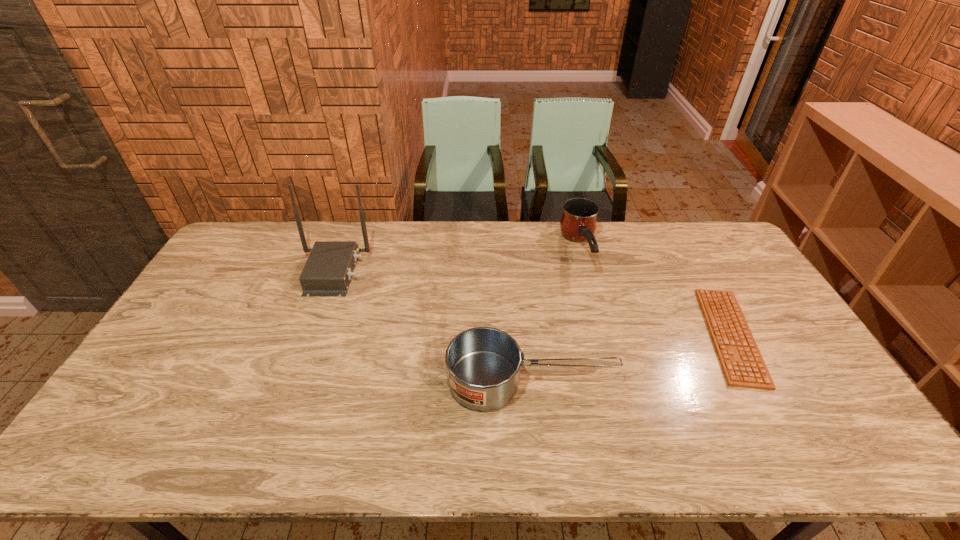
What are the coordinates of `vacant space located 0.220m with the handle extending from one side of the nearer saucepan` in the screenshot? It's located at (697, 381).

The image size is (960, 540). Find the location of `free space located 0.370m on the back of the shortest object`. free space located 0.370m on the back of the shortest object is located at coordinates (670, 225).

Identify the location of router present at the far edge. This screenshot has height=540, width=960. (328, 270).

Where is `saucepan that is at the far edge`? saucepan that is at the far edge is located at coordinates (578, 223).

The width and height of the screenshot is (960, 540). Identify the location of object that is at the right edge. (743, 366).

The height and width of the screenshot is (540, 960). What are the coordinates of `vacant space at the far edge of the desktop` in the screenshot? It's located at (408, 226).

In the image, there is a desktop. Where is `vacant region at the near edge`? The width and height of the screenshot is (960, 540). vacant region at the near edge is located at coordinates (157, 460).

In order to click on free spot at the left edge of the desktop in this screenshot , I will do `click(210, 294)`.

You are a GUI agent. You are given a task and a screenshot of the screen. Output one action in this format:
    pyautogui.click(x=<x>, y=<y>)
    Task: Click on the blank space at the right edge
    The image size is (960, 540).
    Given the screenshot: What is the action you would take?
    pyautogui.click(x=788, y=343)

Locate an element on the screen. The width and height of the screenshot is (960, 540). vacant space at the near right corner of the desktop is located at coordinates (854, 448).